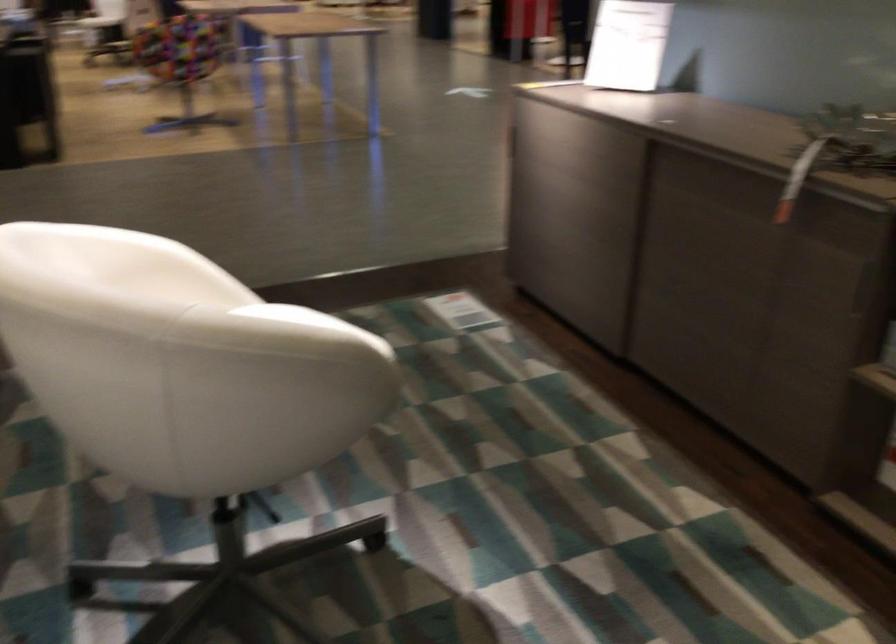
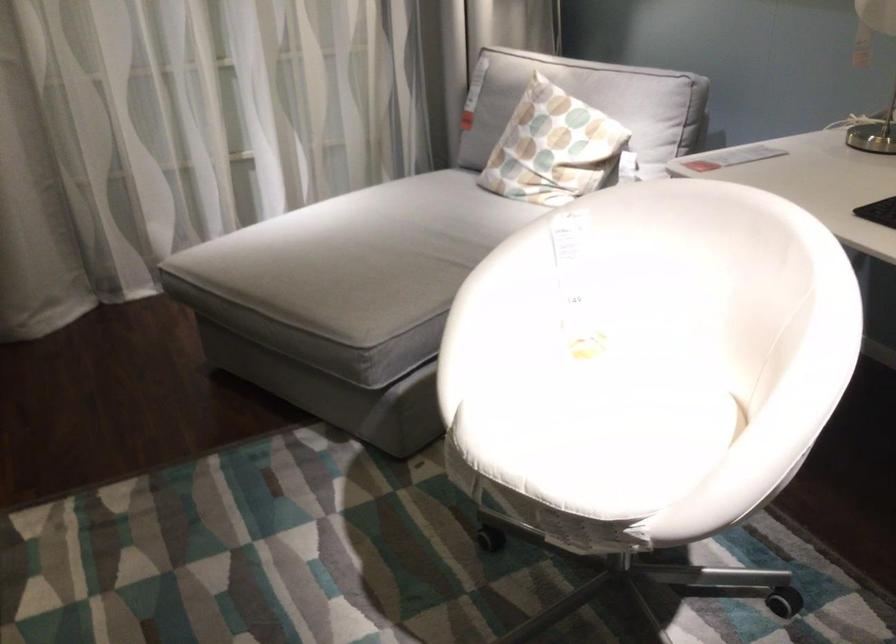
Where in the second image is the point corresponding to point (185, 254) from the first image?

(780, 399)